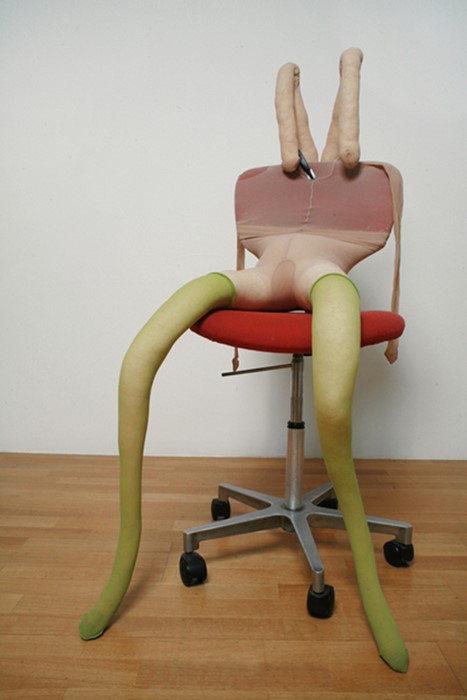
At what (x,y) coordinates should I click in order to perform the action: click on floor. Please return your answer as a coordinate pair (x, y). Looking at the image, I should click on (187, 629).